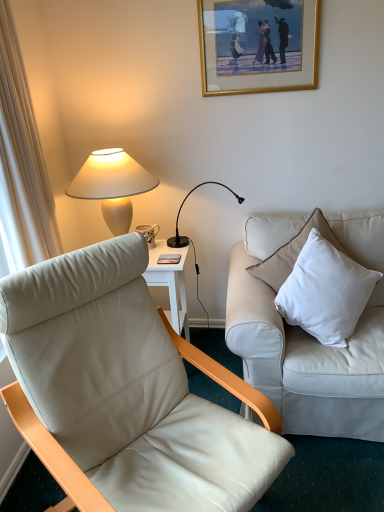
Question: Is white cotton pillow at right further to camera compared to white ceramic lamp at upper left, arranged as the 1th lamp when viewed from the left?

Choices:
 (A) no
 (B) yes

Answer: (A)

Question: From the image's perspective, is white cotton pillow at right located beneath white ceramic lamp at upper left, marked as the second lamp in a right-to-left arrangement?

Choices:
 (A) no
 (B) yes

Answer: (B)

Question: Can you confirm if white cotton pillow at right is positioned to the right of white ceramic lamp at upper left, marked as the second lamp in a right-to-left arrangement?

Choices:
 (A) no
 (B) yes

Answer: (B)

Question: Is white cotton pillow at right facing towards white ceramic lamp at upper left, marked as the second lamp in a right-to-left arrangement?

Choices:
 (A) yes
 (B) no

Answer: (B)

Question: Is white cotton pillow at right not near white ceramic lamp at upper left, arranged as the 1th lamp when viewed from the left?

Choices:
 (A) no
 (B) yes

Answer: (A)

Question: From a real-world perspective, is white cotton pillow at right positioned under white ceramic lamp at upper left, arranged as the 1th lamp when viewed from the left, based on gravity?

Choices:
 (A) yes
 (B) no

Answer: (A)

Question: From a real-world perspective, is matte ceramic mug at upper center physically below black metal/texture desk lamp at upper center, the first lamp from the right?

Choices:
 (A) no
 (B) yes

Answer: (B)

Question: Is matte ceramic mug at upper center to the right of black metal/texture desk lamp at upper center, which ranks as the 2th lamp in left-to-right order, from the viewer's perspective?

Choices:
 (A) no
 (B) yes

Answer: (A)

Question: Considering the relative sizes of matte ceramic mug at upper center and black metal/texture desk lamp at upper center, which ranks as the 2th lamp in left-to-right order, in the image provided, is matte ceramic mug at upper center wider than black metal/texture desk lamp at upper center, which ranks as the 2th lamp in left-to-right order,?

Choices:
 (A) yes
 (B) no

Answer: (B)

Question: Is matte ceramic mug at upper center bigger than black metal/texture desk lamp at upper center, the first lamp from the right?

Choices:
 (A) no
 (B) yes

Answer: (A)

Question: Can you confirm if matte ceramic mug at upper center is smaller than black metal/texture desk lamp at upper center, the first lamp from the right?

Choices:
 (A) yes
 (B) no

Answer: (A)

Question: Can you confirm if matte ceramic mug at upper center is taller than black metal/texture desk lamp at upper center, the first lamp from the right?

Choices:
 (A) no
 (B) yes

Answer: (A)

Question: Does white leather couch at right have a smaller size compared to black metal/texture desk lamp at upper center, which ranks as the 2th lamp in left-to-right order?

Choices:
 (A) yes
 (B) no

Answer: (B)